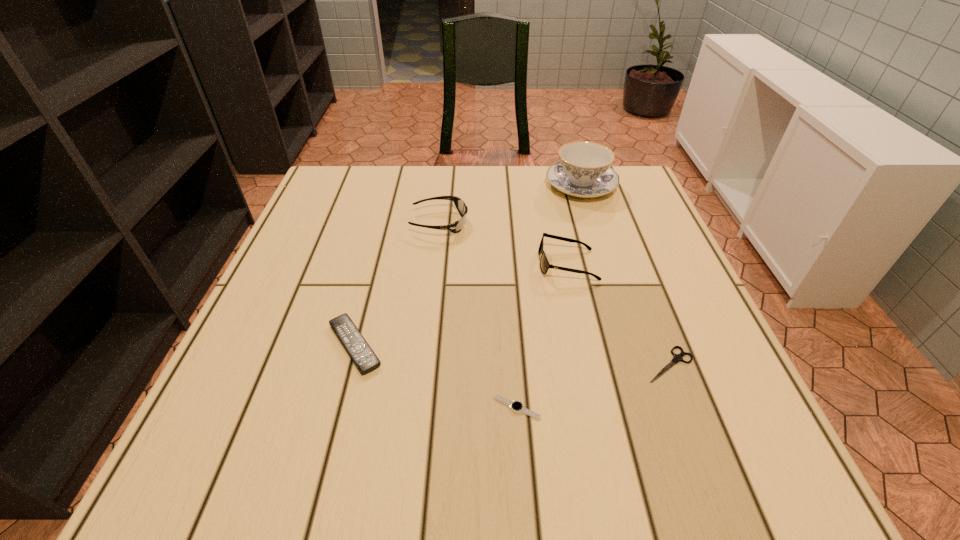
Identify the location of vacant area at the near right corner. The height and width of the screenshot is (540, 960). (683, 460).

Where is `vacant point located between the fourth object from right to left and the shears`? The width and height of the screenshot is (960, 540). vacant point located between the fourth object from right to left and the shears is located at coordinates (593, 386).

At what (x,y) coordinates should I click in order to perform the action: click on free space between the shears and the nearest object. Please return your answer as a coordinate pair (x, y). The width and height of the screenshot is (960, 540). Looking at the image, I should click on point(593,386).

This screenshot has height=540, width=960. Identify the location of vacant region between the left sunglasses and the chinaware. pyautogui.click(x=510, y=204).

Identify the location of empty space that is in between the watch and the third farthest object. This screenshot has width=960, height=540. (542, 336).

Where is `vacant area between the farthest object and the farther sunglasses`? Image resolution: width=960 pixels, height=540 pixels. vacant area between the farthest object and the farther sunglasses is located at coordinates (510, 204).

The height and width of the screenshot is (540, 960). What are the coordinates of `vacant area that lies between the shears and the leftmost object` in the screenshot? It's located at (513, 355).

Locate an element on the screen. free point between the farther sunglasses and the right sunglasses is located at coordinates (503, 244).

Where is `empty space that is in between the right sunglasses and the third object from left to right`? This screenshot has height=540, width=960. empty space that is in between the right sunglasses and the third object from left to right is located at coordinates (542, 336).

This screenshot has height=540, width=960. I want to click on unoccupied area between the chinaware and the third farthest object, so click(574, 225).